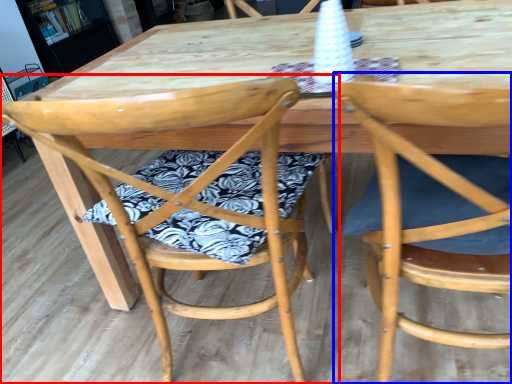
Question: Which point is closer to the camera, chair (highlighted by a red box) or chair (highlighted by a blue box)?

Choices:
 (A) chair
 (B) chair

Answer: (B)